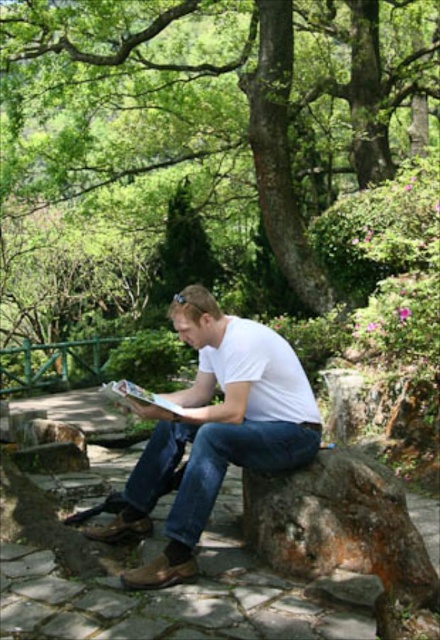
In the scene shown: You are a fashion designer observing the man in the scene. You need to determine whether the white cotton shirt at center can be paired with the blue denim jeans at center based on their sizes. Can the shirt be worn over the jeans without any adjustments?

The white cotton shirt at center has a larger width than the blue denim jeans at center, so it can be worn over the jeans without any adjustments as the shirt is wider and will naturally drape over the jeans.